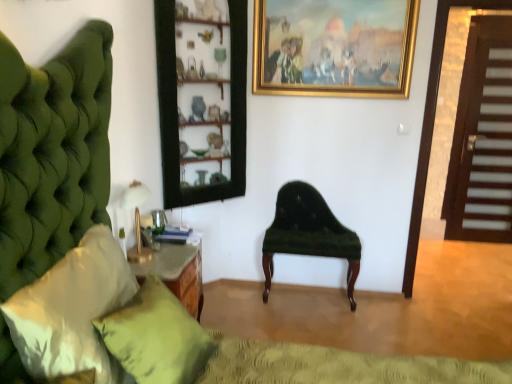
Question: Is wooden shelves at center further to camera compared to green fabric pillow at lower left, placed as the second pillow when sorted from front to back?

Choices:
 (A) no
 (B) yes

Answer: (B)

Question: Can you confirm if wooden shelves at center is taller than green fabric pillow at lower left, positioned as the first pillow in back-to-front order?

Choices:
 (A) yes
 (B) no

Answer: (A)

Question: Is wooden shelves at center bigger than green fabric pillow at lower left, positioned as the first pillow in back-to-front order?

Choices:
 (A) no
 (B) yes

Answer: (B)

Question: From a real-world perspective, is wooden shelves at center over green fabric pillow at lower left, positioned as the first pillow in back-to-front order?

Choices:
 (A) yes
 (B) no

Answer: (A)

Question: Is wooden shelves at center to the right of green fabric pillow at lower left, placed as the second pillow when sorted from front to back, from the viewer's perspective?

Choices:
 (A) no
 (B) yes

Answer: (B)

Question: Is wooden shelves at center positioned with its back to green fabric pillow at lower left, positioned as the first pillow in back-to-front order?

Choices:
 (A) no
 (B) yes

Answer: (A)

Question: From the image's perspective, is wooden shelves at center located beneath velvet green bench at center?

Choices:
 (A) no
 (B) yes

Answer: (A)

Question: Are wooden shelves at center and velvet green bench at center making contact?

Choices:
 (A) yes
 (B) no

Answer: (B)

Question: Would you consider wooden shelves at center to be distant from velvet green bench at center?

Choices:
 (A) yes
 (B) no

Answer: (B)

Question: Considering the relative sizes of wooden shelves at center and velvet green bench at center in the image provided, is wooden shelves at center wider than velvet green bench at center?

Choices:
 (A) yes
 (B) no

Answer: (B)

Question: Does wooden shelves at center turn towards velvet green bench at center?

Choices:
 (A) yes
 (B) no

Answer: (B)

Question: Is wooden shelves at center positioned in front of velvet green bench at center?

Choices:
 (A) yes
 (B) no

Answer: (A)

Question: Does white satin pillow at left, positioned as the 2th pillow in back-to-front order, appear on the right side of green fabric pillow at lower left, placed as the second pillow when sorted from front to back?

Choices:
 (A) yes
 (B) no

Answer: (B)